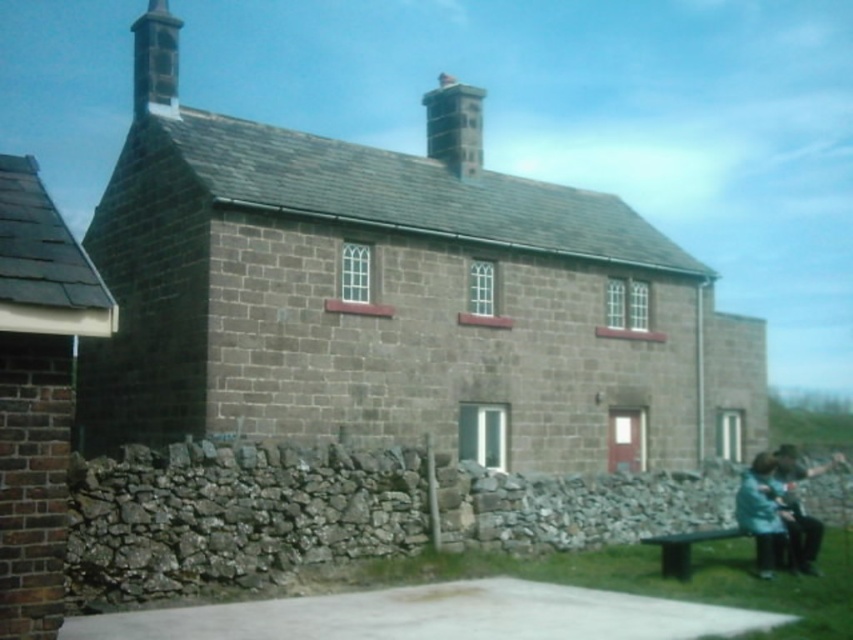
You are standing in front of the traditional stone house and want to locate the smooth stone chimney at upper left. Based on the 2D coordinates provided, where should you look relative to the center of the image?

The smooth stone chimney at upper left is located at coordinates 0.095 on the x axis and 0.183 on the y axis, which places it slightly to the left and above the center of the image.

You are a painter standing in front of the traditional stone house. You need to decide which object to paint first based on their sizes. Which object is wider between the smooth stone chimney at upper left and the blue fabric at lower right?

The smooth stone chimney at upper left is wider than the blue fabric at lower right.